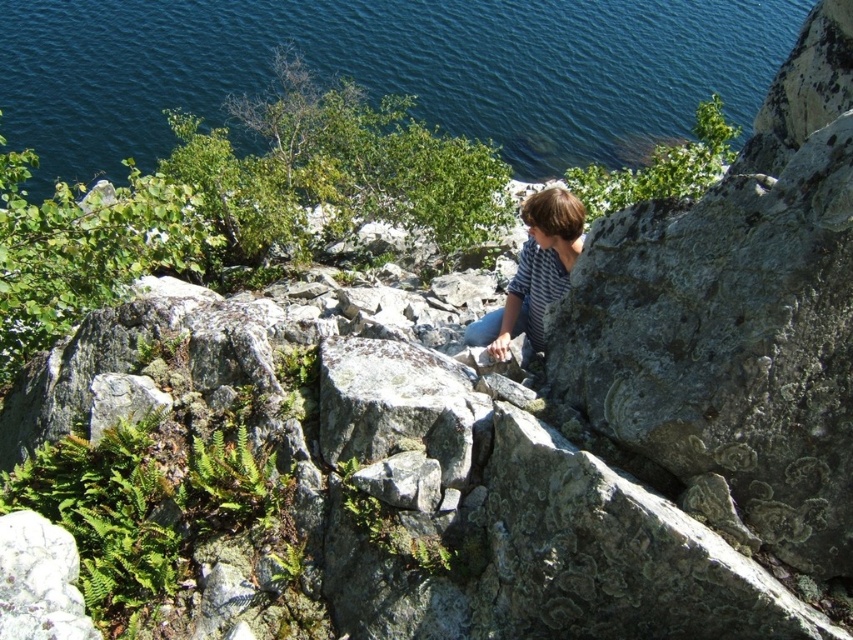
Question: In this image, where is blue water at upper center located relative to striped cotton shirt at center?

Choices:
 (A) left
 (B) right

Answer: (B)

Question: In this image, where is blue water at upper center located relative to striped cotton shirt at center?

Choices:
 (A) right
 (B) left

Answer: (A)

Question: Among these objects, which one is nearest to the camera?

Choices:
 (A) striped cotton shirt at center
 (B) blue water at upper center

Answer: (A)

Question: Is blue water at upper center positioned behind striped cotton shirt at center?

Choices:
 (A) no
 (B) yes

Answer: (B)

Question: Among these objects, which one is nearest to the camera?

Choices:
 (A) blue water at upper center
 (B) striped cotton shirt at center

Answer: (B)